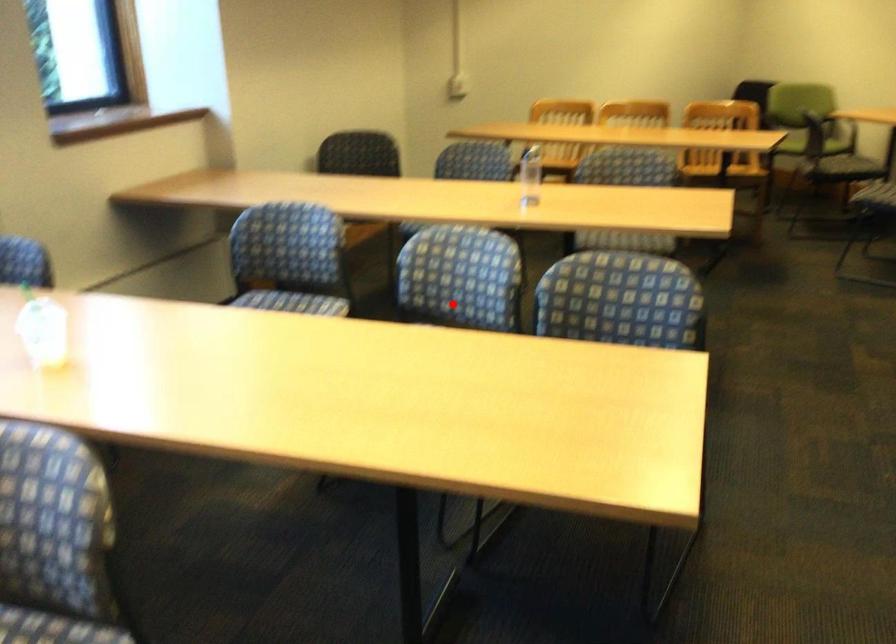
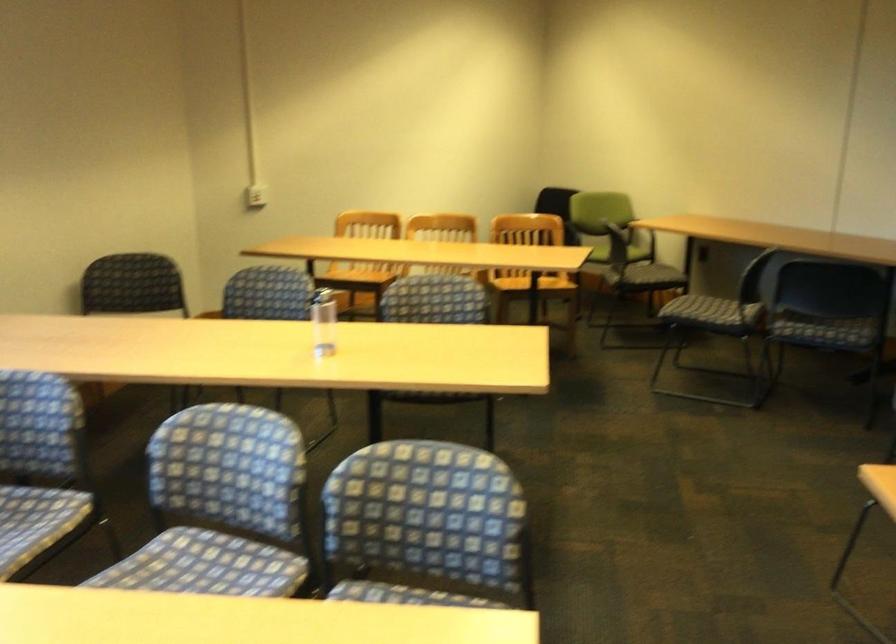
In the second image, find the point that corresponds to the highlighted location in the first image.

(221, 506)